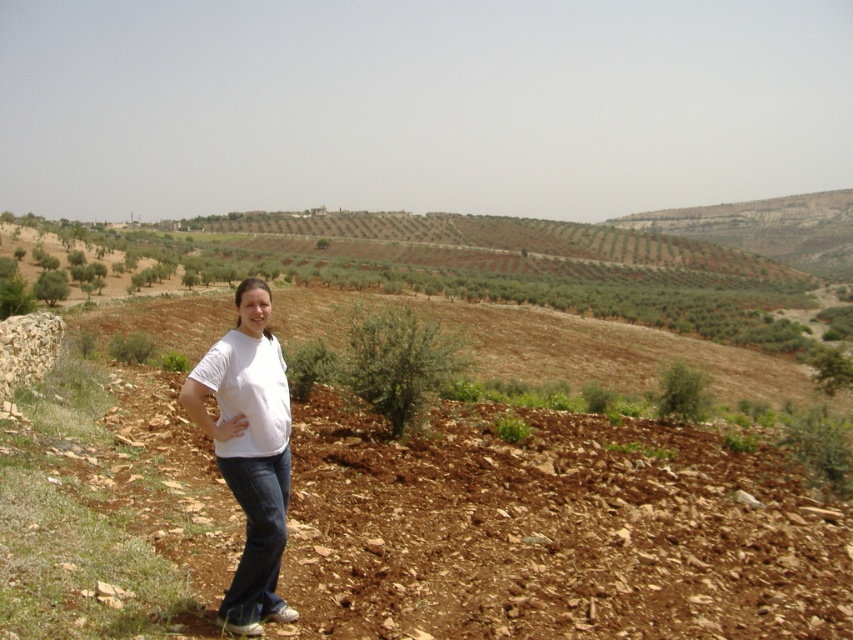
From the picture: You are a drone operator trying to capture a photo of the olive groves. You have two points marked in the scene for reference. The first point is at coordinates point (619,481) and the second is at point (254,497). Which point is closer to the camera?

Point (254,497) is closer to the camera than point (619,481).

You are standing at the position of the person in the image. You want to walk to the brown rocky dirt track at center. In which direction should you move relative to your current position?

The brown rocky dirt track at center is located at point coordinates of (552, 531). Since the person is positioned slightly off to the left of the frame, moving towards the center would mean heading towards the right direction relative to their current position.